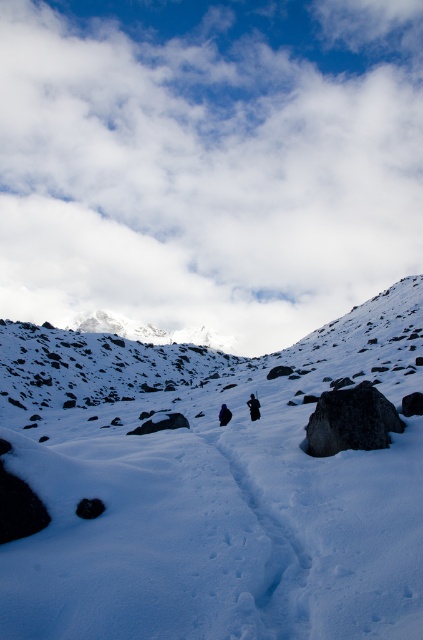
In the scene shown: Which of these two, dark gray rock at center or black matte jacket at center, stands taller?

With more height is dark gray rock at center.

Who is positioned more to the left, dark gray rock at center or black matte jacket at center?

black matte jacket at center is more to the left.

Looking at this image, who is more forward, (x=359, y=449) or (x=250, y=394)?

Point (x=359, y=449)

This screenshot has width=423, height=640. In order to click on dark gray rock at center in this screenshot , I will do `click(351, 420)`.

Does white powdery snow at center have a greater width compared to black fabric person at center?

Yes.

Find the location of `white powdery snow at center`. white powdery snow at center is located at coordinates (214, 492).

This screenshot has height=640, width=423. I want to click on white powdery snow at center, so click(x=214, y=492).

Measure the distance between dark gray rock at center and camera.

A distance of 30.34 meters exists between dark gray rock at center and camera.

Can you confirm if dark gray rock at center is taller than black fabric person at center?

Correct, dark gray rock at center is much taller as black fabric person at center.

Does point (378, 445) come behind point (219, 417)?

No, (378, 445) is in front of (219, 417).

Identify the location of dark gray rock at center. This screenshot has width=423, height=640. (351, 420).